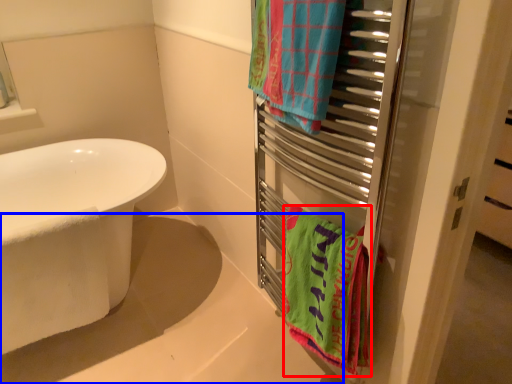
Question: Which object is closer to the camera taking this photo, towel/napkin (highlighted by a red box) or bath (highlighted by a blue box)?

Choices:
 (A) towel/napkin
 (B) bath

Answer: (B)